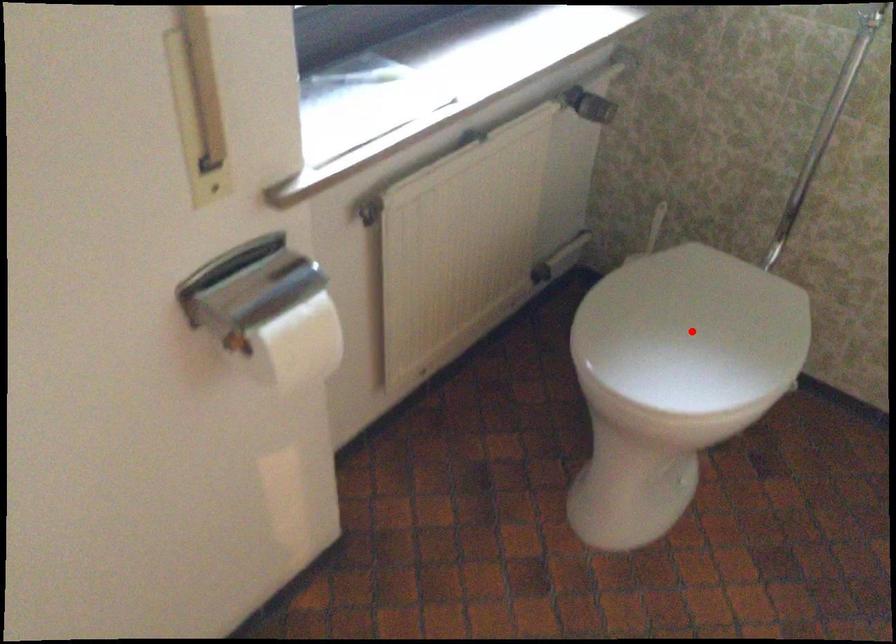
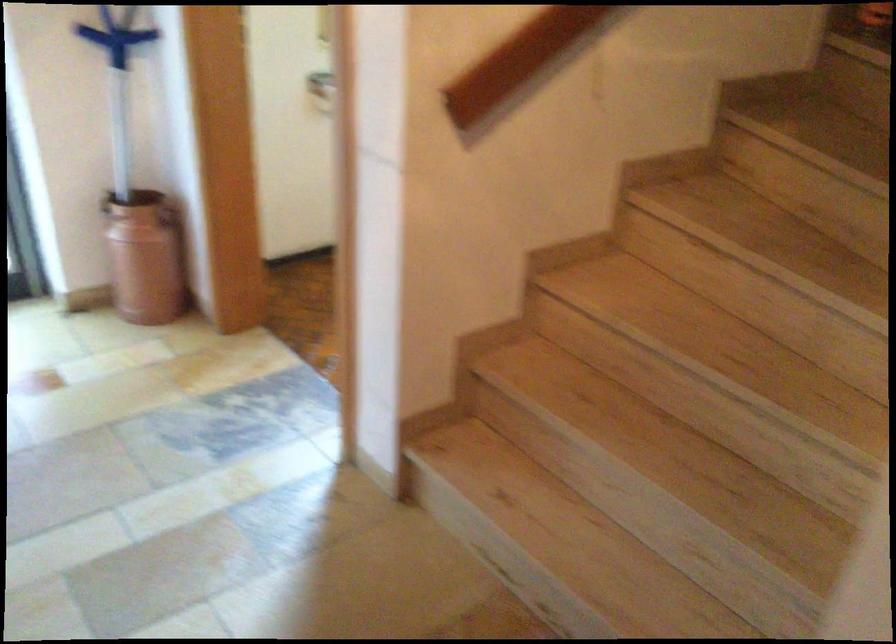
Question: I am providing you with two images of the same scene from different viewpoints. A red point is marked on the first image. Is the red point's position out of view in image 2?

Choices:
 (A) Yes
 (B) No

Answer: (A)